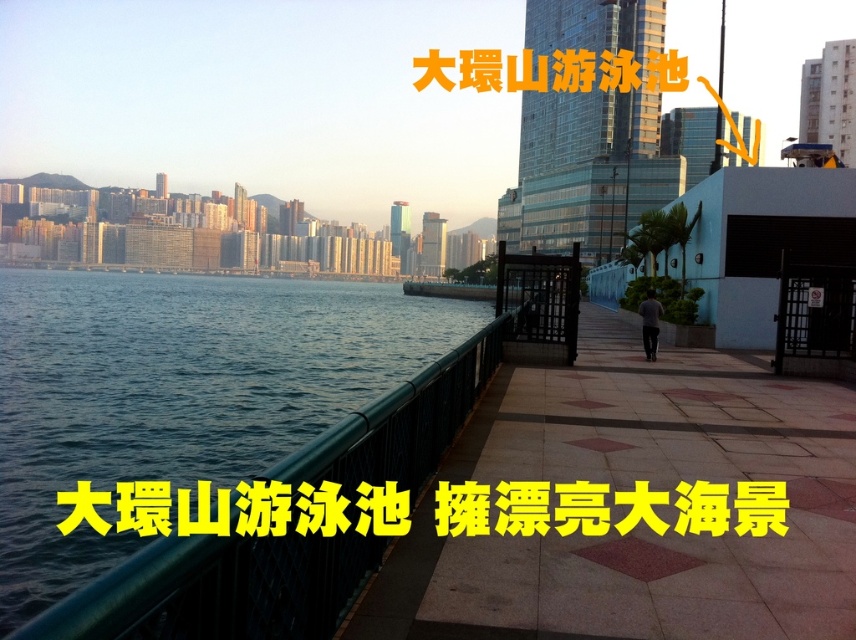
You are standing at the waterfront and want to take a photo of the green metal railing at left. Where should you position yourself to capture it in your shot?

To capture the green metal railing at left in your photo, position yourself at point (629, 486) as specified in the scene description.

Looking at this image, you are designing a new walkway and want to ensure there is enough space between the green metal railing at left and the green metallic railing at lower left. According to the scene, which railing is narrower and therefore requires less space?

The green metal railing at left is narrower than the green metallic railing at lower left, so it requires less space.